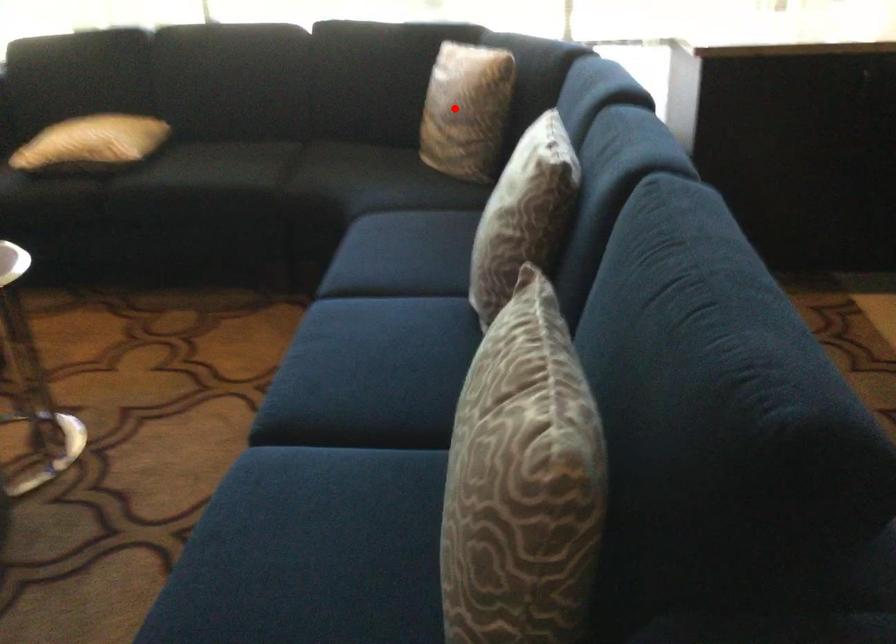
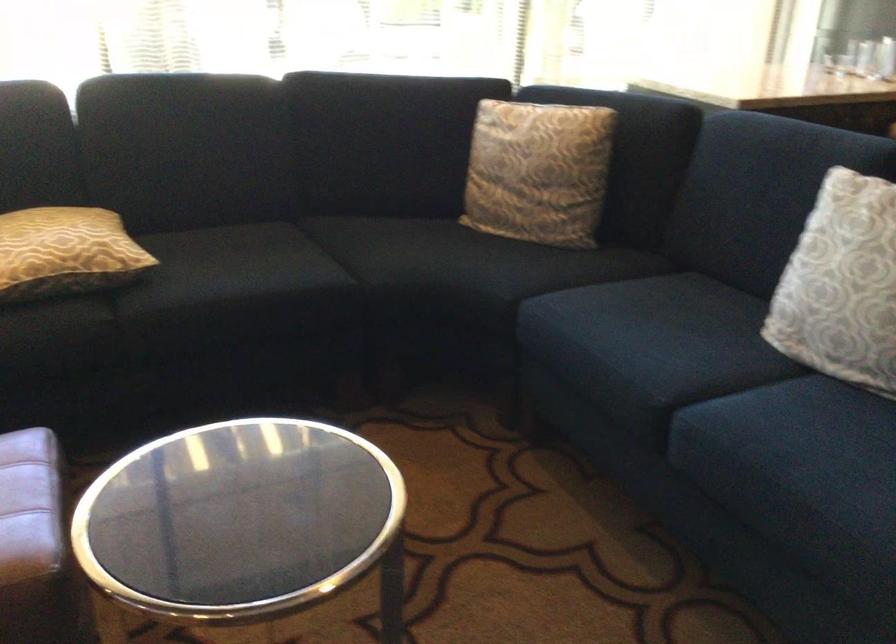
Question: A red point is marked in image1. In image2, is the corresponding 3D point closer to the camera or farther? Reply with the corresponding letter.

Choices:
 (A) The corresponding 3D point is closer.
 (B) The corresponding 3D point is farther.

Answer: (A)